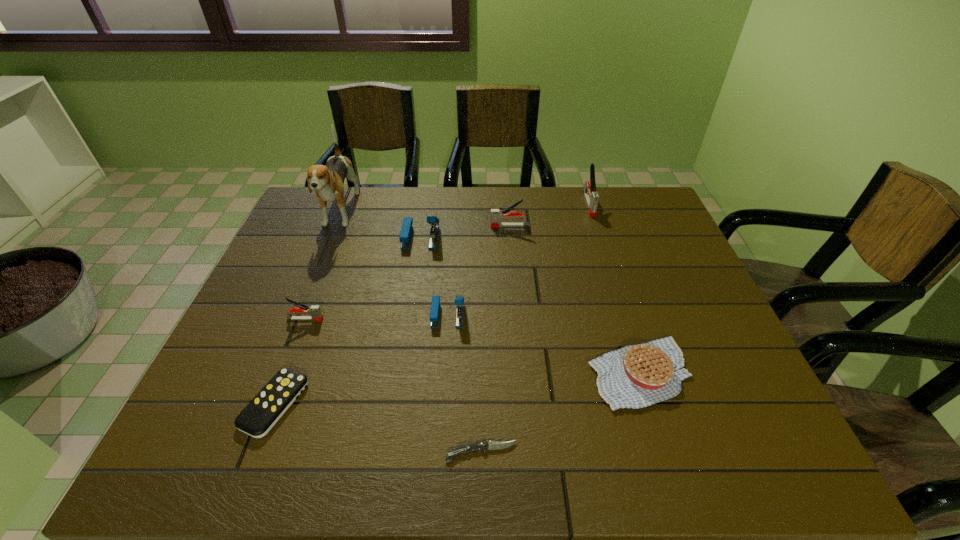
You are a GUI agent. You are given a task and a screenshot of the screen. Output one action in this format:
    pyautogui.click(x=<x>, y=<y>)
    Task: Click on the free space that satisfies the following two spatial constraints: 1. on the back side of the remote control; 2. on the right side of the brown pie
    This screenshot has height=540, width=960.
    Given the screenshot: What is the action you would take?
    pyautogui.click(x=287, y=373)